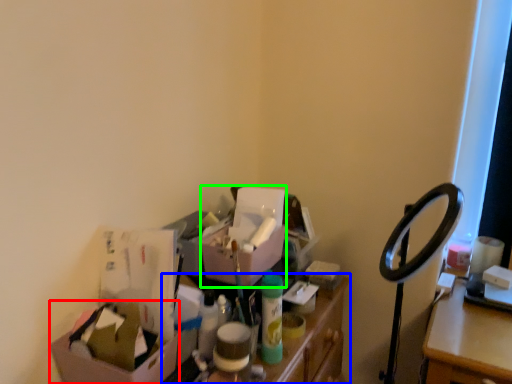
Question: Which object is positioned farthest from box (highlighted by a red box)? Select from furniture (highlighted by a blue box) and box (highlighted by a green box).

Choices:
 (A) furniture
 (B) box

Answer: (B)